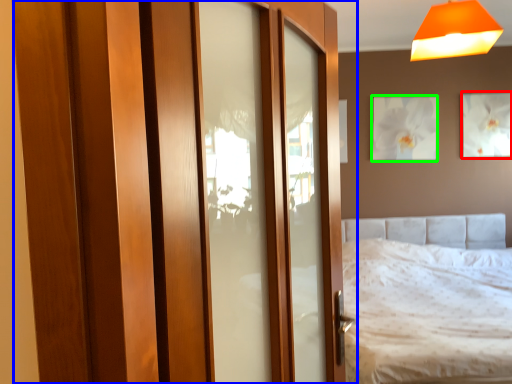
Question: Which object is the closest to the picture frame (highlighted by a red box)? Choose among these: door (highlighted by a blue box) or picture frame (highlighted by a green box).

Choices:
 (A) door
 (B) picture frame

Answer: (B)